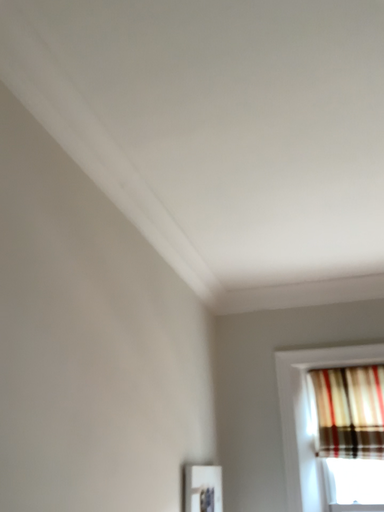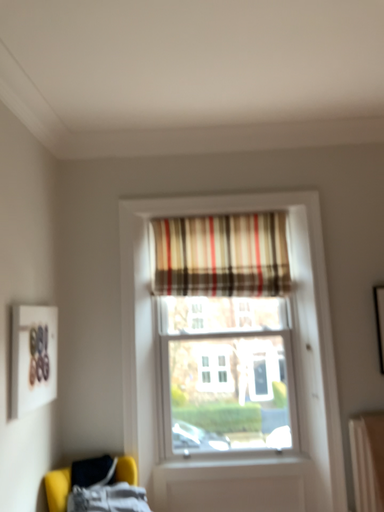
Question: Which way did the camera rotate in the video?

Choices:
 (A) rotated upward
 (B) rotated downward

Answer: (B)